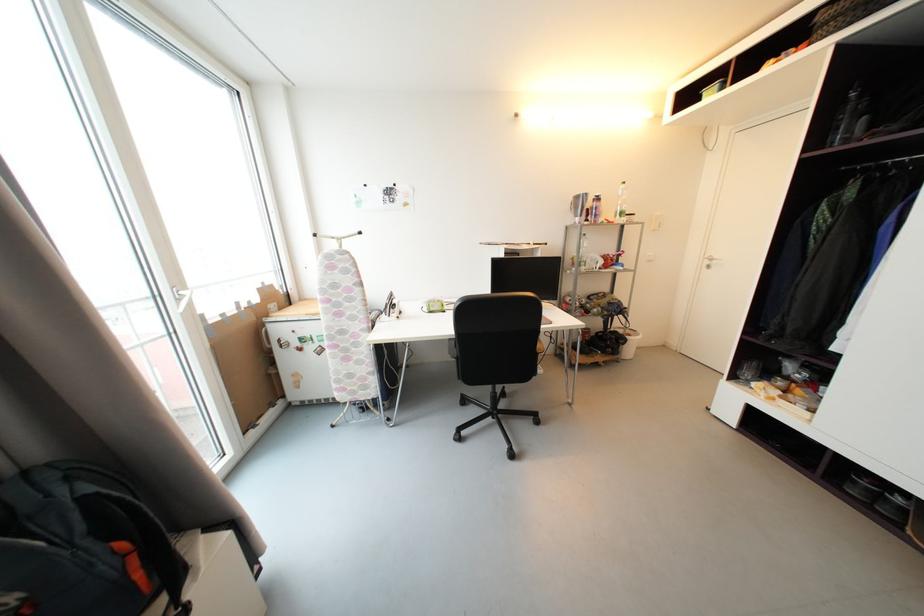
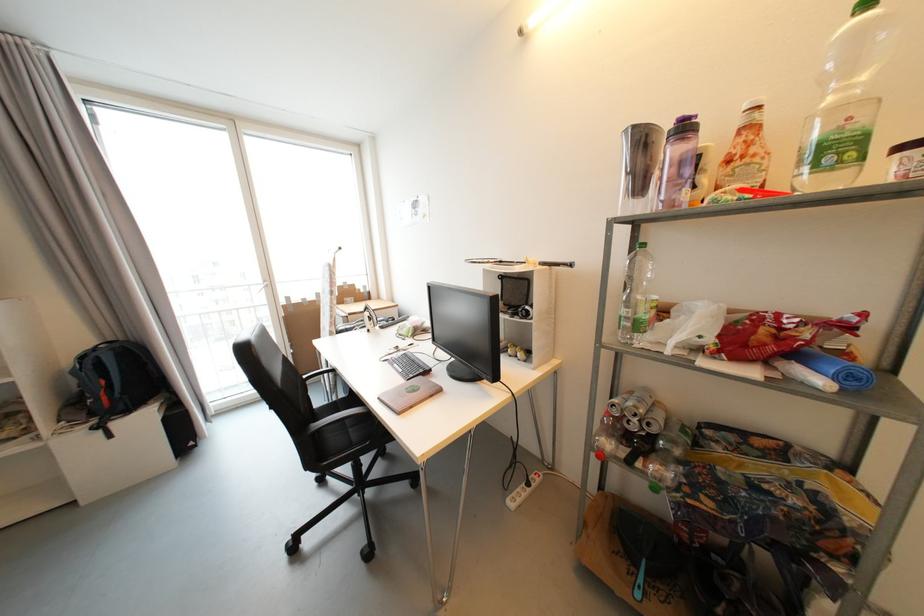
In the second image, find the point that corresponds to (x=602, y=201) in the first image.

(689, 130)